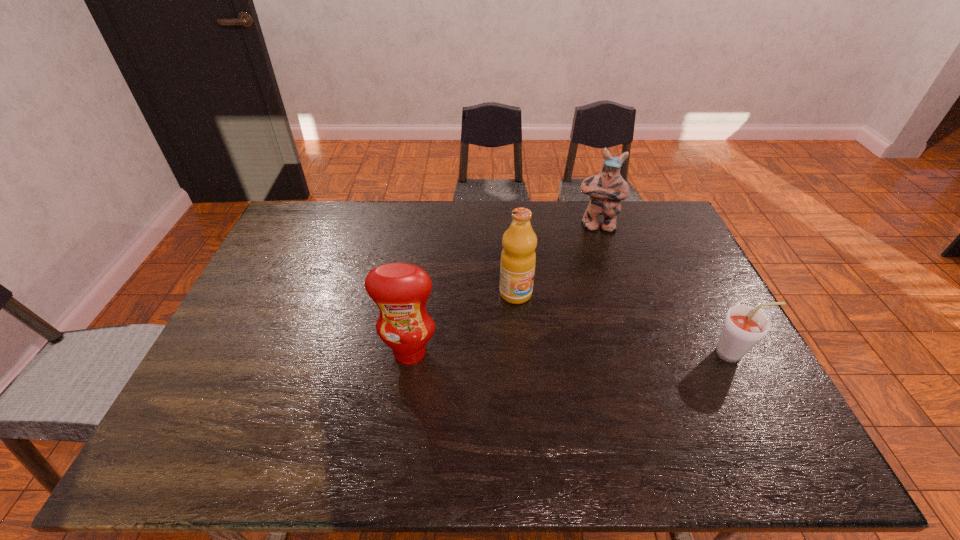
Image resolution: width=960 pixels, height=540 pixels. Find the location of `condiment`. condiment is located at coordinates (400, 290).

Where is `the rightmost object`? the rightmost object is located at coordinates (744, 326).

Find the location of a particular element. root beer is located at coordinates (744, 326).

Identify the location of the farthest object. (606, 190).

Locate an element on the screen. The height and width of the screenshot is (540, 960). the second object from right to left is located at coordinates (606, 190).

I want to click on the second farthest object, so click(x=518, y=258).

Locate an element on the screen. The image size is (960, 540). fruit juice is located at coordinates (518, 258).

You are a GUI agent. You are given a task and a screenshot of the screen. Output one action in this format:
    pyautogui.click(x=<x>, y=<y>)
    Task: Click on the free region located 0.090m on the label side of the leftmost object
    The width and height of the screenshot is (960, 540).
    Given the screenshot: What is the action you would take?
    pyautogui.click(x=403, y=399)

Locate an element on the screen. This screenshot has height=540, width=960. vacant space situated 0.070m on the front-facing side of the farthest object is located at coordinates (597, 247).

Where is `free space located 0.220m on the front-facing side of the farthest object`? This screenshot has width=960, height=540. free space located 0.220m on the front-facing side of the farthest object is located at coordinates (599, 277).